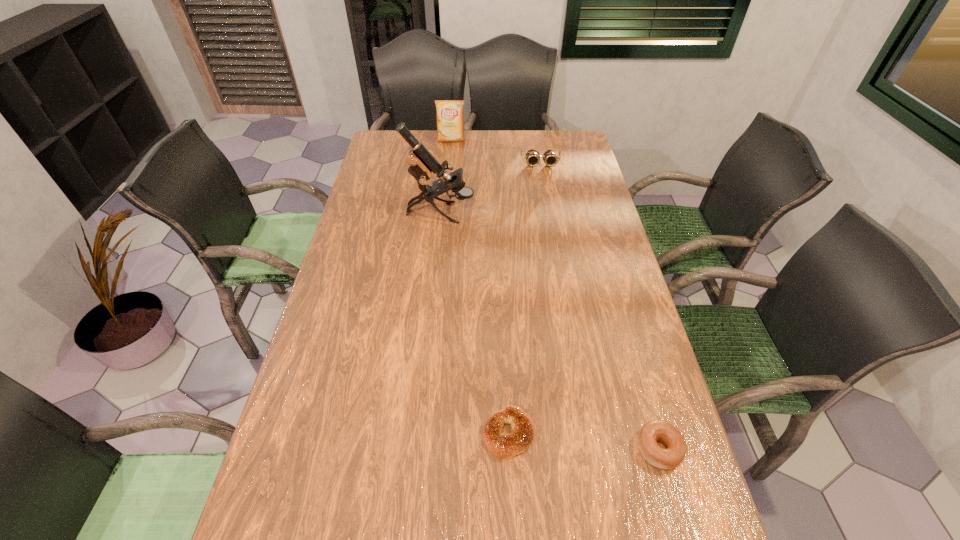
This screenshot has width=960, height=540. I want to click on free space at the far edge of the desktop, so click(x=469, y=139).

This screenshot has height=540, width=960. In the image, there is a desktop. Identify the location of vacant space at the left edge. (345, 399).

Where is `free region at the right edge of the desktop`? free region at the right edge of the desktop is located at coordinates (622, 379).

You are a GUI agent. You are given a task and a screenshot of the screen. Output one action in this format:
    pyautogui.click(x=<x>, y=<y>)
    Task: Click on the free space at the far left corner
    
    Given the screenshot: What is the action you would take?
    pyautogui.click(x=395, y=159)

Identify the location of free space that is in between the left bagel and the right bagel. (584, 441).

At what (x,y) coordinates should I click in order to perform the action: click on free space between the microscope and the second shortest object. Please return your answer as a coordinate pair (x, y). Image resolution: width=960 pixels, height=540 pixels. Looking at the image, I should click on (550, 330).

At what (x,y) coordinates should I click in order to perform the action: click on vacant space that is in between the right bagel and the crisp (potato chip). Please return your answer as a coordinate pair (x, y). This screenshot has width=960, height=540. Looking at the image, I should click on (x=555, y=294).

At what (x,y) coordinates should I click in order to perform the action: click on free space between the farthest object and the left bagel. Please return your answer as a coordinate pair (x, y). This screenshot has height=540, width=960. Looking at the image, I should click on [x=480, y=287].

You are a GUI agent. You are given a task and a screenshot of the screen. Output one action in this format:
    pyautogui.click(x=<x>, y=<y>)
    Task: Click on the unoccupied area between the second tallest object and the left bagel
    The width and height of the screenshot is (960, 540).
    Given the screenshot: What is the action you would take?
    pyautogui.click(x=480, y=287)

What are the coordinates of `vacant space in between the shorter bagel and the microscope` in the screenshot? It's located at (474, 323).